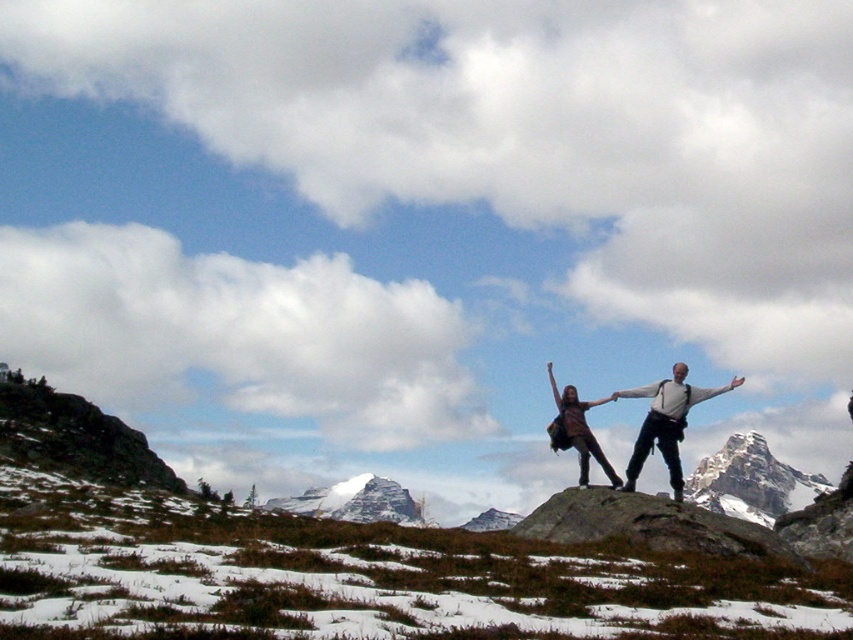
You are a hiker planning to take a photo of the snowy granite peak at upper right and the striped fabric dress at center. From your current position, which object is located to the right of the other?

The snowy granite peak at upper right is positioned on the right side of striped fabric dress at center, so the snowy granite peak at upper right is to the right of the striped fabric dress at center.

You are planning a hiking route and need to decide the direction to go next. You see the snowy granite peak at upper right and the matte brown backpack at center. Which object is located to the east if the image is oriented with north at the top?

The snowy granite peak at upper right is to the right of the matte brown backpack at center. Since the image is oriented with north at the top, right would correspond to east. Therefore, the snowy granite peak at upper right is located to the east of the matte brown backpack at center.

You are a hiker who just arrived at the rocky outcrop. You see the matte brown backpack at center and the striped fabric dress at center. Which item is covering the other?

The matte brown backpack at center is positioned over striped fabric dress at center, so the backpack is covering the dress.